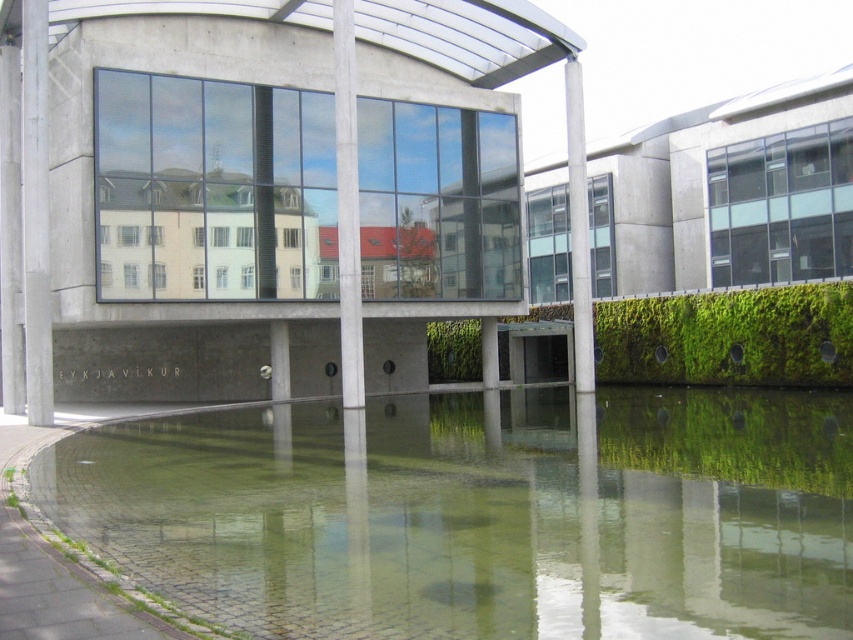
Question: Does green mossy pond at lower center appear on the left side of concrete pillar at left?

Choices:
 (A) no
 (B) yes

Answer: (A)

Question: Among these objects, which one is farthest from the camera?

Choices:
 (A) gray concrete pillar at center
 (B) smooth concrete pillar at center

Answer: (A)

Question: Which point is closer to the camera taking this photo?

Choices:
 (A) (79, 536)
 (B) (39, 180)

Answer: (A)

Question: Is concrete pillar at left wider than smooth concrete pillar at center?

Choices:
 (A) no
 (B) yes

Answer: (B)

Question: Which object is the closest to the smooth concrete pillar at center?

Choices:
 (A) green mossy pond at lower center
 (B) concrete pillar at left
 (C) gray concrete pillar at center

Answer: (B)

Question: In this image, where is smooth concrete pillar at center located relative to gray concrete pillar at center?

Choices:
 (A) below
 (B) above

Answer: (A)